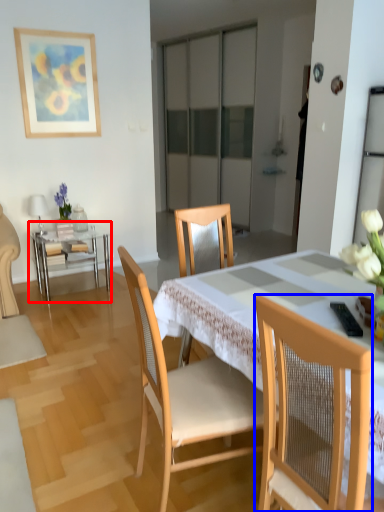
Question: Which object appears farthest to the camera in this image, table (highlighted by a red box) or chair (highlighted by a blue box)?

Choices:
 (A) table
 (B) chair

Answer: (A)